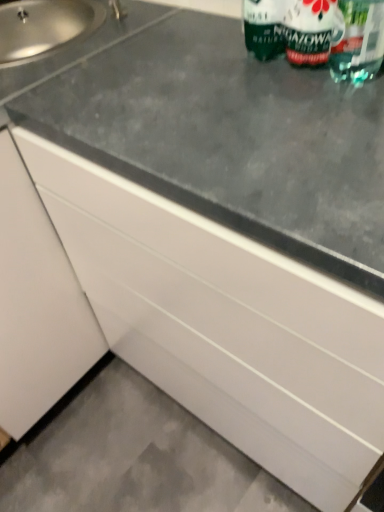
Question: Is green matte bottle at upper right positioned before gray concrete at lower left?

Choices:
 (A) yes
 (B) no

Answer: (A)

Question: Does green matte bottle at upper right have a greater height compared to gray concrete at lower left?

Choices:
 (A) no
 (B) yes

Answer: (B)

Question: From a real-world perspective, is green matte bottle at upper right on gray concrete at lower left?

Choices:
 (A) no
 (B) yes

Answer: (B)

Question: From a real-world perspective, is green matte bottle at upper right positioned under gray concrete at lower left based on gravity?

Choices:
 (A) yes
 (B) no

Answer: (B)

Question: Is green matte bottle at upper right located outside gray concrete at lower left?

Choices:
 (A) yes
 (B) no

Answer: (A)

Question: Based on their sizes in the image, would you say satin steel sink at upper left is bigger or smaller than gray concrete at lower left?

Choices:
 (A) big
 (B) small

Answer: (A)

Question: Visually, is satin steel sink at upper left positioned to the left or to the right of gray concrete at lower left?

Choices:
 (A) left
 (B) right

Answer: (A)

Question: Is satin steel sink at upper left wider or thinner than gray concrete at lower left?

Choices:
 (A) thin
 (B) wide

Answer: (A)

Question: Relative to gray concrete at lower left, is satin steel sink at upper left in front or behind?

Choices:
 (A) front
 (B) behind

Answer: (A)

Question: Is transparent plastic straw at upper right spatially inside gray concrete at lower left, or outside of it?

Choices:
 (A) inside
 (B) outside

Answer: (B)

Question: Would you say transparent plastic straw at upper right is to the left or to the right of gray concrete at lower left in the picture?

Choices:
 (A) right
 (B) left

Answer: (A)

Question: Is point (370, 75) closer or farther from the camera than point (24, 508)?

Choices:
 (A) farther
 (B) closer

Answer: (B)

Question: From a real-world perspective, is transparent plastic straw at upper right positioned above or below gray concrete at lower left?

Choices:
 (A) above
 (B) below

Answer: (A)

Question: In the image, is satin steel sink at upper left positioned in front of or behind green matte bottle at upper right?

Choices:
 (A) behind
 (B) front

Answer: (A)

Question: Looking at their shapes, would you say satin steel sink at upper left is wider or thinner than green matte bottle at upper right?

Choices:
 (A) wide
 (B) thin

Answer: (A)